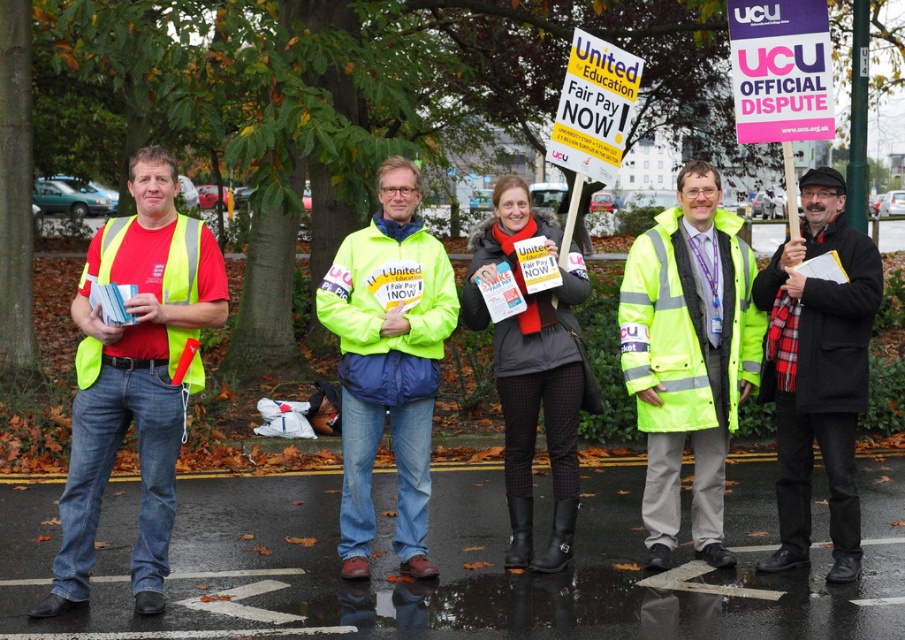
Does neon yellow jacket at center come behind black matte scarf at center?

No, neon yellow jacket at center is closer to the viewer.

Which of these two, neon yellow jacket at center or black matte scarf at center, stands taller?

Standing taller between the two is neon yellow jacket at center.

Between point (357, 536) and point (513, 506), which one is positioned behind?

Positioned behind is point (513, 506).

This screenshot has width=905, height=640. What are the coordinates of `neon yellow jacket at center` in the screenshot? It's located at [388, 362].

What do you see at coordinates (688, 356) in the screenshot? The height and width of the screenshot is (640, 905). I see `high visibility jacket at center` at bounding box center [688, 356].

Is high visibility jacket at center to the right of neon yellow jacket at center from the viewer's perspective?

Yes, high visibility jacket at center is to the right of neon yellow jacket at center.

Is point (649, 481) more distant than point (446, 259)?

That is False.

Where is `high visibility jacket at center`? This screenshot has width=905, height=640. high visibility jacket at center is located at coordinates (688, 356).

Is neon yellow jacket at center closer to camera compared to high visibility yellow safety vest at left?

No, neon yellow jacket at center is behind high visibility yellow safety vest at left.

You are a GUI agent. You are given a task and a screenshot of the screen. Output one action in this format:
    pyautogui.click(x=<x>, y=<y>)
    Task: Click on the neon yellow jacket at center
    
    Given the screenshot: What is the action you would take?
    pyautogui.click(x=388, y=362)

What do you see at coordinates (388, 362) in the screenshot? The height and width of the screenshot is (640, 905). I see `neon yellow jacket at center` at bounding box center [388, 362].

Find the location of a particular element. neon yellow jacket at center is located at coordinates (388, 362).